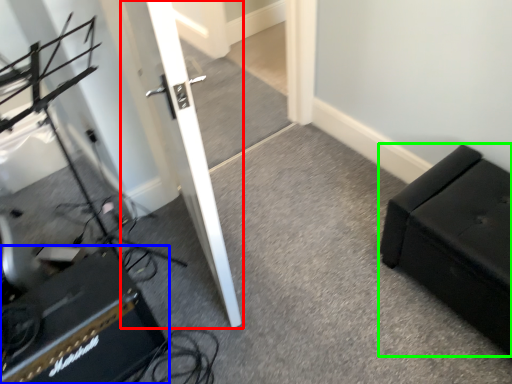
Question: Estimate the real-world distances between objects in this image. Which object is farther from door (highlighted by a red box), speaker (highlighted by a blue box) or furniture (highlighted by a green box)?

Choices:
 (A) speaker
 (B) furniture

Answer: (B)